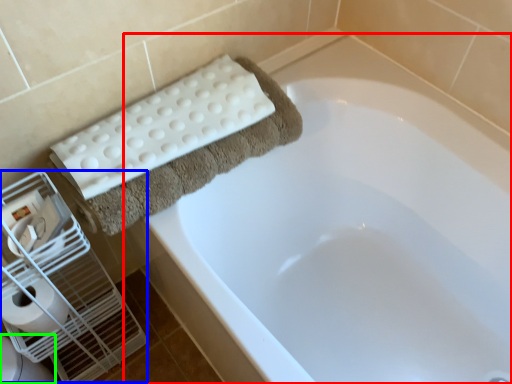
Question: Which object is the farthest from bathtub (highlighted by a red box)? Choose among these: bird cage (highlighted by a blue box) or toilet bowl (highlighted by a green box).

Choices:
 (A) bird cage
 (B) toilet bowl

Answer: (B)